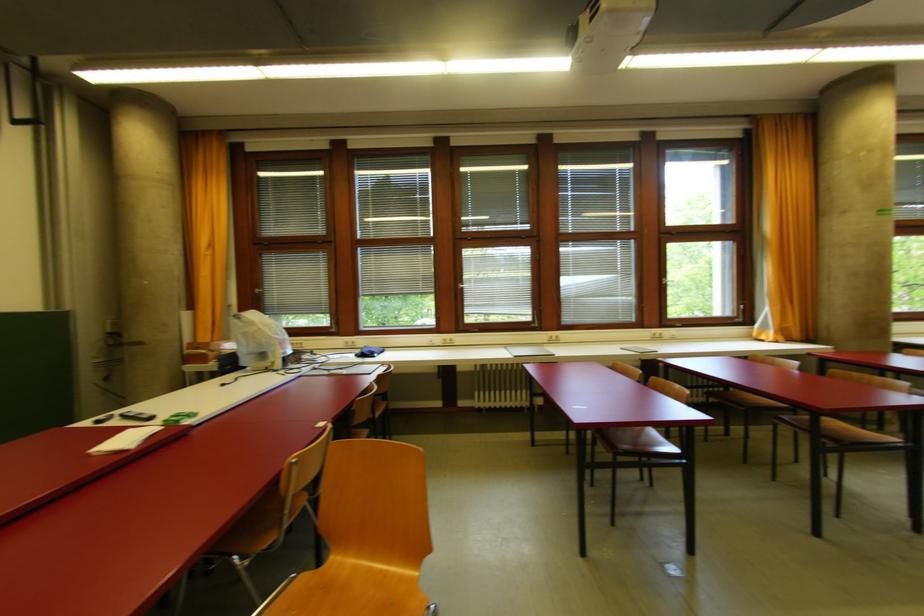
Locate an element on the screen. The width and height of the screenshot is (924, 616). dark window handle is located at coordinates (463, 286).